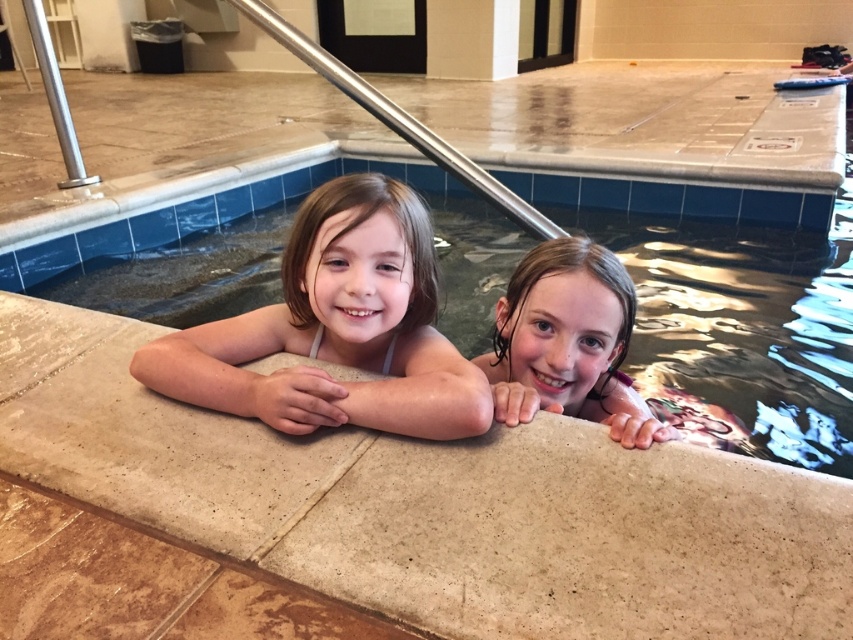
Question: Does smooth concrete pool at center have a greater width compared to wet hair at upper right?

Choices:
 (A) yes
 (B) no

Answer: (A)

Question: Which object is farther from the camera taking this photo?

Choices:
 (A) beige stone ledge at center
 (B) smooth skin child at center
 (C) wet hair at upper right

Answer: (C)

Question: Which point is farther from the camera taking this photo?

Choices:
 (A) (675, 474)
 (B) (421, 292)

Answer: (B)

Question: Which object is the farthest from the wet hair at upper right?

Choices:
 (A) smooth concrete pool at center
 (B) smooth skin child at center
 (C) beige stone ledge at center

Answer: (A)

Question: Is beige stone ledge at center thinner than smooth skin child at center?

Choices:
 (A) no
 (B) yes

Answer: (A)

Question: Can you confirm if smooth concrete pool at center is positioned to the right of smooth skin child at center?

Choices:
 (A) no
 (B) yes

Answer: (B)